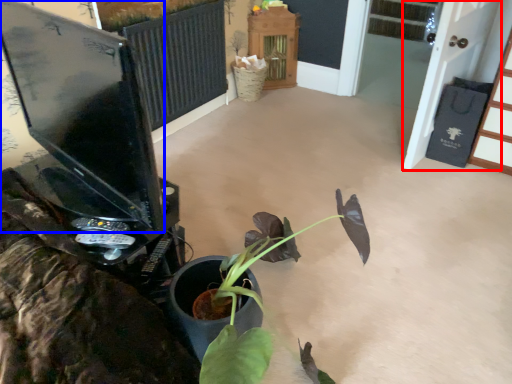
Question: Which object is closer to the camera taking this photo, screen door (highlighted by a red box) or computer monitor (highlighted by a blue box)?

Choices:
 (A) screen door
 (B) computer monitor

Answer: (B)